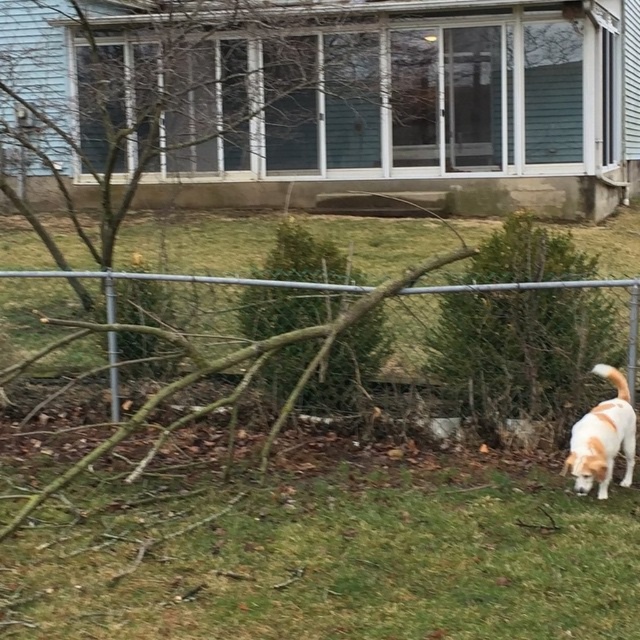
You are a delivery person approaching the house. You see the metallic silver fence at center and the white fur dog at lower right. Which object is closer to the front of the image?

The white fur dog at lower right is closer to the front of the image because the metallic silver fence at center is located above it, meaning the dog is positioned in front.

Based on the photo, you are standing at the point closest to the house in the residential scene. Which point, point [483,602] or point [538,352], is closer to you?

Point [483,602] is closer to you because it is in front of point [538,352].

You are a gardener assessing the space between the brown textured tree at center and the metallic silver fence at center. Which object is smaller in size?

The brown textured tree at center is smaller than the metallic silver fence at center.